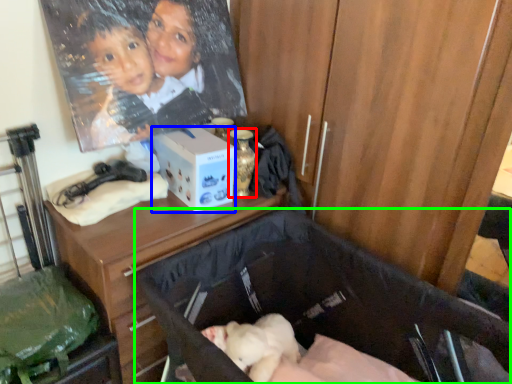
Question: Based on their relative distances, which object is nearer to bottle (highlighted by a red box)? Choose from box (highlighted by a blue box) and baby carriage (highlighted by a green box).

Choices:
 (A) box
 (B) baby carriage

Answer: (A)